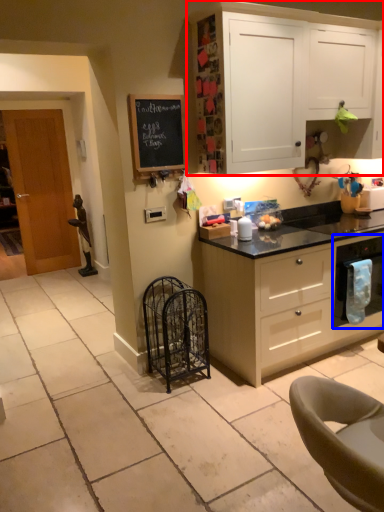
Question: Which object is further to the camera taking this photo, cabinetry (highlighted by a red box) or kitchen appliance (highlighted by a blue box)?

Choices:
 (A) cabinetry
 (B) kitchen appliance

Answer: (B)